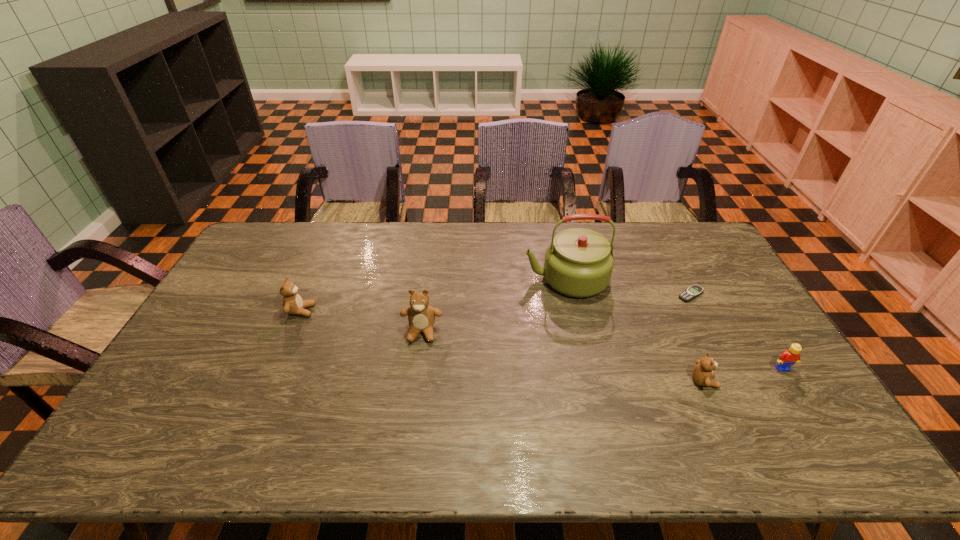
To achieve even spacing by inserting another teddy_bear among them, please point to a vacant spot for this new teddy_bear. Please provide its 2D coordinates. Your answer should be formatted as a tuple, i.e. [(x, y)], where the tuple contains the x and y coordinates of a point satisfying the conditions above.

[(556, 355)]